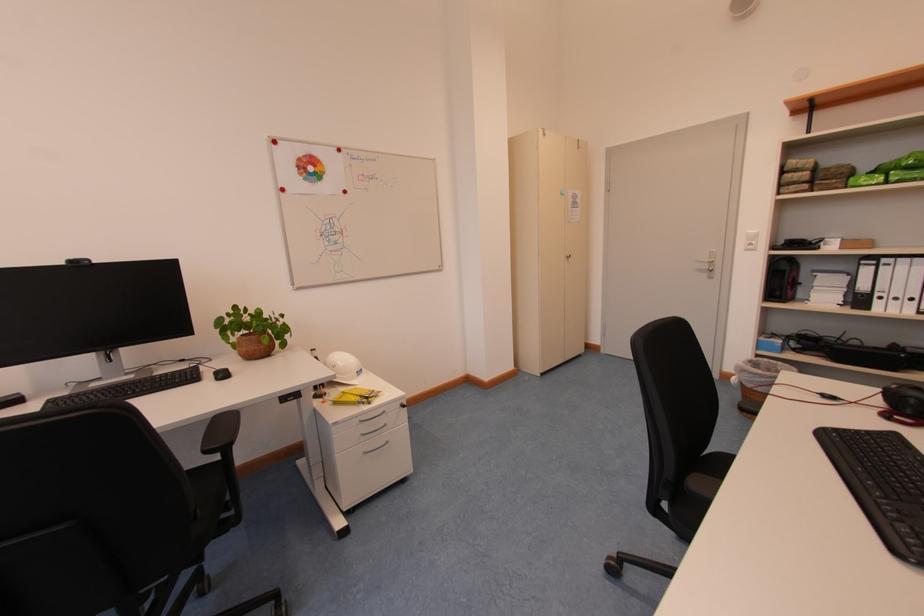
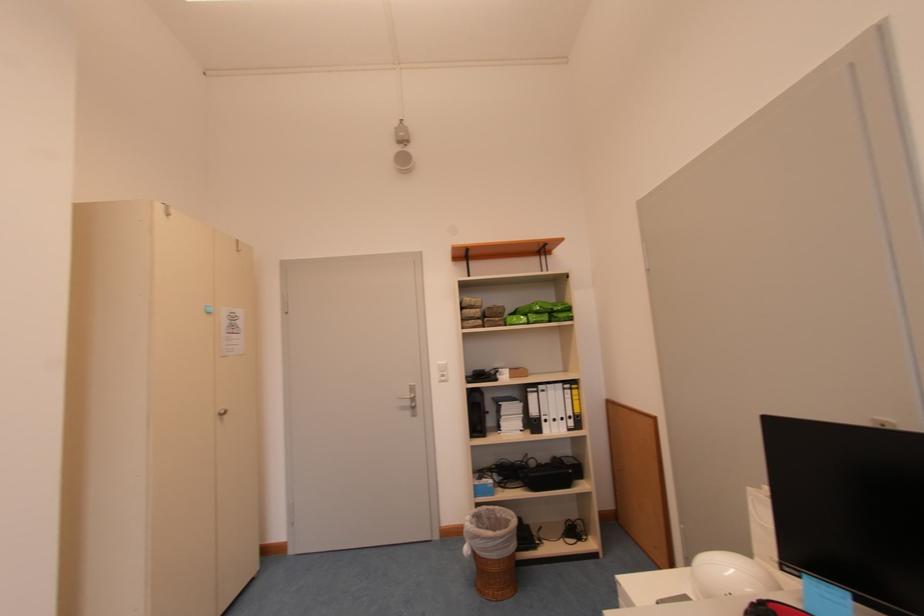
Where in the second image is the point corresponding to point 881,174 from the first image?

(521, 315)